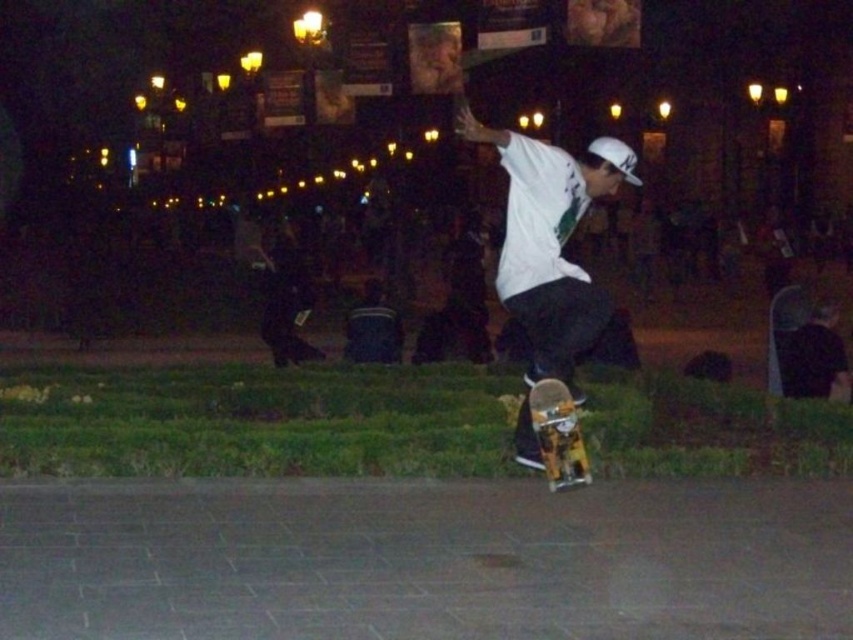
Question: Which point is farther to the camera?

Choices:
 (A) (577, 429)
 (B) (538, 362)

Answer: (B)

Question: Which object is farther from the camera taking this photo?

Choices:
 (A) white matte shirt at center
 (B) yellow and black graphic skateboard at center

Answer: (B)

Question: Considering the relative positions of white matte shirt at center and yellow and black graphic skateboard at center in the image provided, where is white matte shirt at center located with respect to yellow and black graphic skateboard at center?

Choices:
 (A) right
 (B) left

Answer: (A)

Question: Is white matte shirt at center smaller than yellow and black graphic skateboard at center?

Choices:
 (A) no
 (B) yes

Answer: (A)

Question: Is white matte shirt at center above yellow and black graphic skateboard at center?

Choices:
 (A) no
 (B) yes

Answer: (B)

Question: Among these points, which one is nearest to the camera?

Choices:
 (A) (561, 248)
 (B) (537, 410)

Answer: (B)